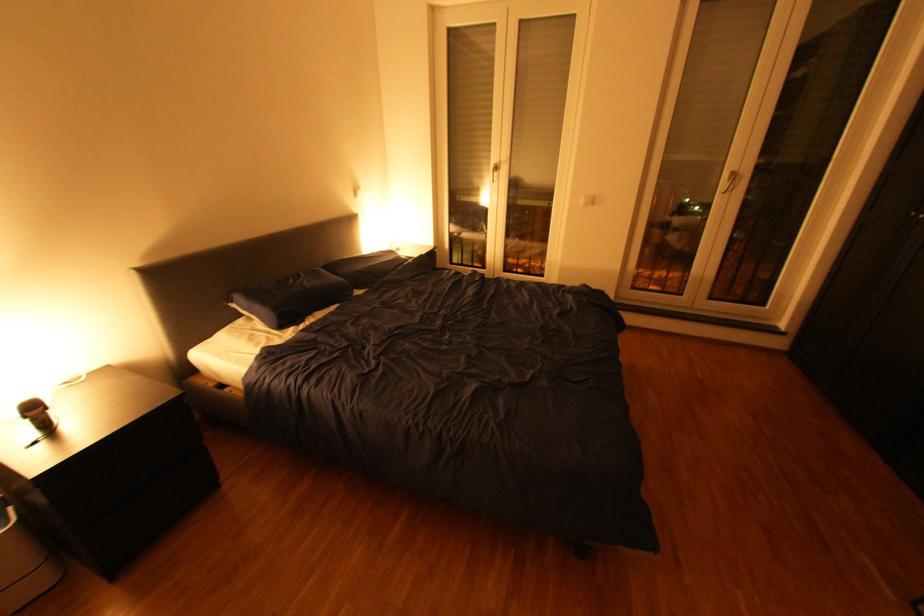
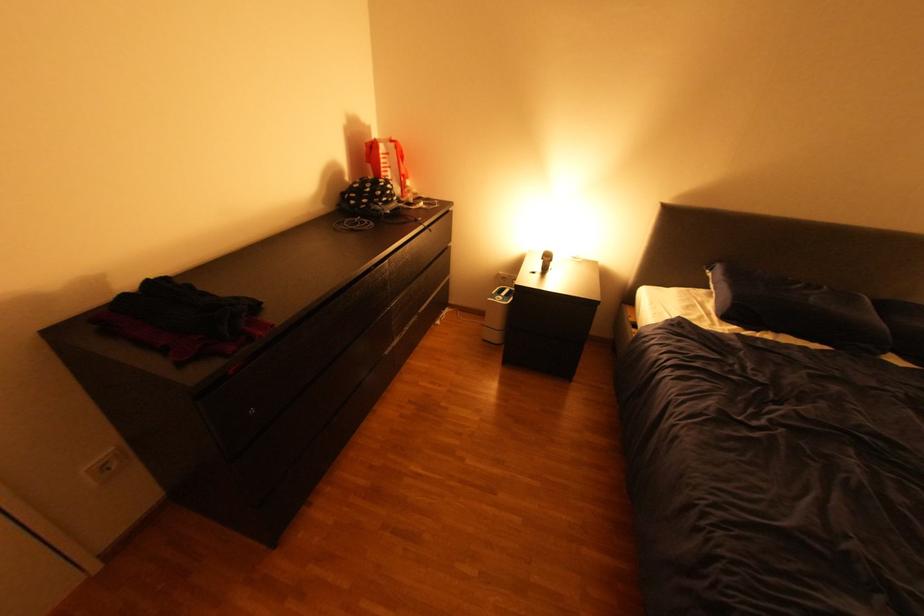
Where in the second image is the point corresponding to (301,328) from the first image?

(745, 326)